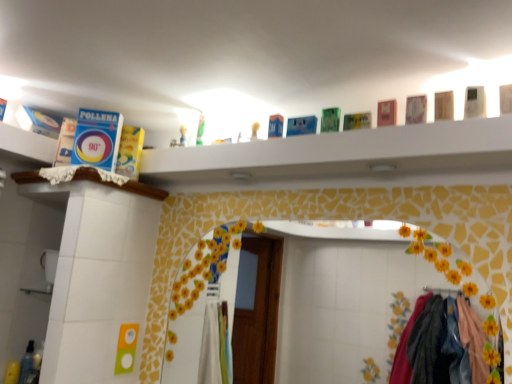
Question: From the image's perspective, relative to wooden ledge at upper left, the 2th ledge viewed from the top, is blue cardboard box at upper center, placed as the 2th ledge when sorted from bottom to top, above or below?

Choices:
 (A) above
 (B) below

Answer: (A)

Question: From a real-world perspective, relative to wooden ledge at upper left, marked as the 1th ledge in a bottom-to-top arrangement, is blue cardboard box at upper center, arranged as the first ledge when viewed from the top, vertically above or below?

Choices:
 (A) below
 (B) above

Answer: (B)

Question: Estimate the real-world distances between objects in this image. Which object is closer to the wooden ledge at upper left, marked as the 1th ledge in a bottom-to-top arrangement?

Choices:
 (A) white mosaic mirror at center
 (B) blue cardboard box at upper center, arranged as the first ledge when viewed from the top
 (C) translucent plastic bottle at lower left

Answer: (B)

Question: Which is farther from the translucent plastic bottle at lower left?

Choices:
 (A) blue cardboard box at upper center, placed as the 2th ledge when sorted from bottom to top
 (B) wooden ledge at upper left, marked as the 1th ledge in a bottom-to-top arrangement
 (C) white mosaic mirror at center

Answer: (C)